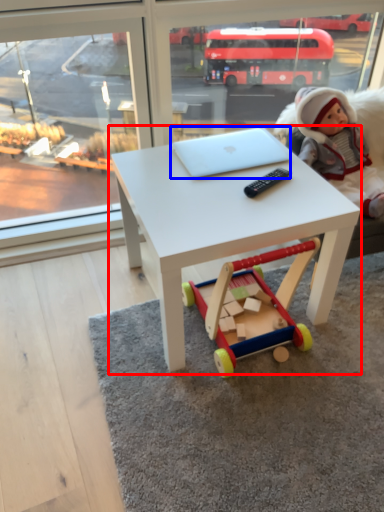
Question: Among these objects, which one is nearest to the camera, table (highlighted by a red box) or laptop (highlighted by a blue box)?

Choices:
 (A) table
 (B) laptop

Answer: (A)